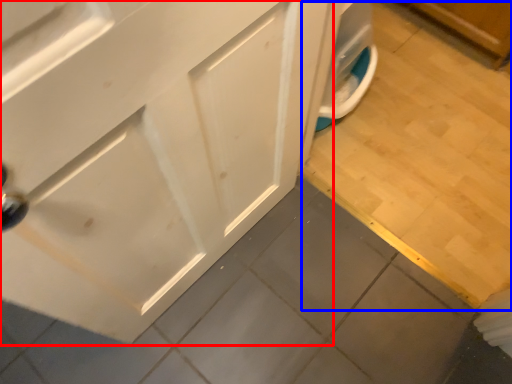
Question: Which object is closer to the camera taking this photo, cabinetry (highlighted by a red box) or tile (highlighted by a blue box)?

Choices:
 (A) cabinetry
 (B) tile

Answer: (A)